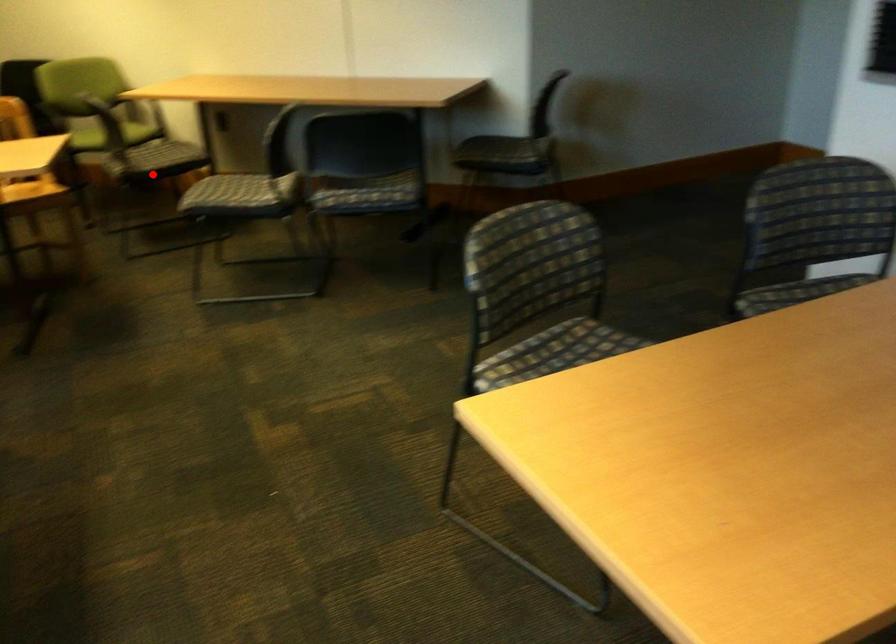
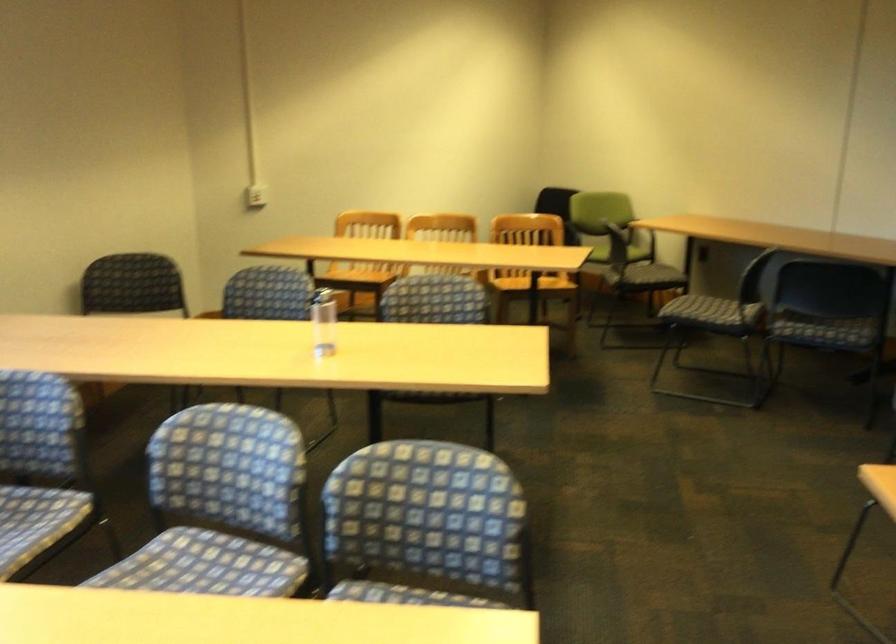
Question: I am providing you with two images of the same scene from different viewpoints. In image1, a red point is highlighted. Considering the same 3D point in image2, which of the following is correct?

Choices:
 (A) It is closer
 (B) It is farther

Answer: (B)